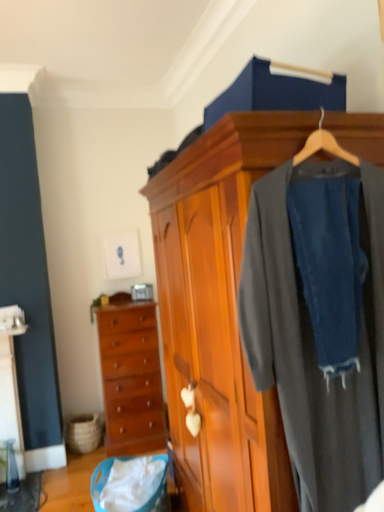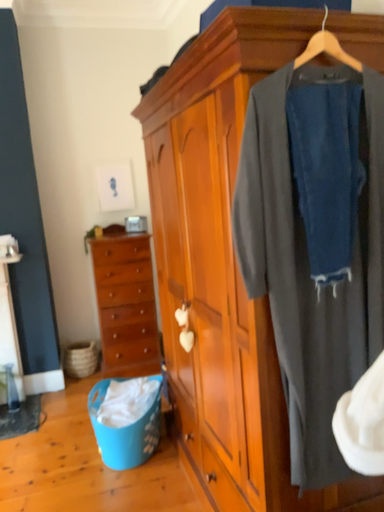
Question: How did the camera likely rotate when shooting the video?

Choices:
 (A) rotated downward
 (B) rotated upward

Answer: (A)